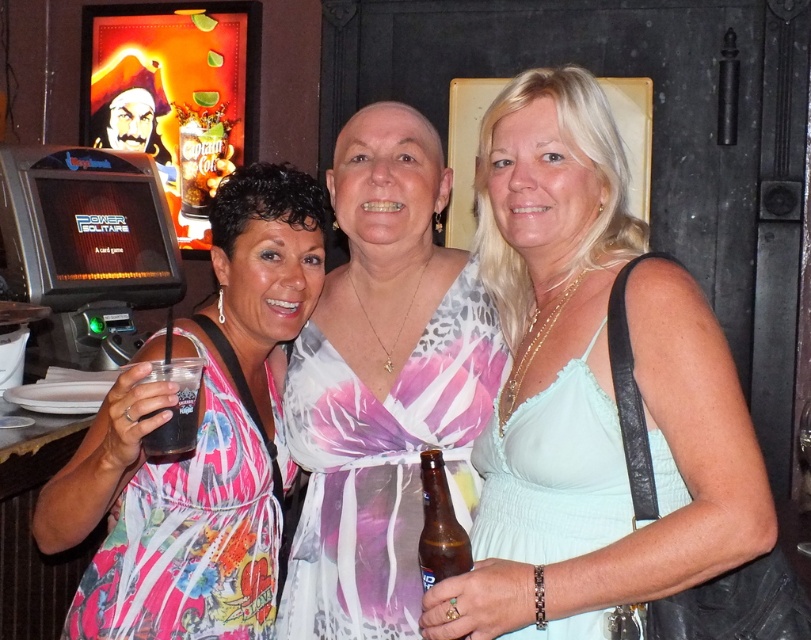
You are a photographer at the event and want to take a photo that includes both the light blue fabric dress at center and the translucent plastic cup at left. Which object should you focus on first to ensure both are in focus?

You should focus on the light blue fabric dress at center first since it is closer to the viewer than the translucent plastic cup at left, ensuring both will be in focus when focusing on the closer object.

You are standing in front of the slot machine and want to move towards the two points marked in the image. Which point, point [556,84] or point [162,376], is closer to you?

Point [556,84] is closer to you because it is further to the viewer than point [162,376].

You are a bartender at the bar and need to place a new drink order. You have a brown glass bottle at center and a shiny pirate head at upper left. Which object is bigger in size?

The shiny pirate head at upper left is larger in size than the brown glass bottle at center, so the shiny pirate head at upper left is bigger.